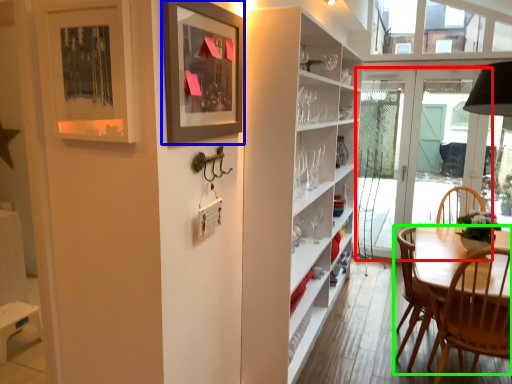
Question: Which object is positioned closest to door (highlighted by a red box)? Select from picture frame (highlighted by a blue box) and chair (highlighted by a green box).

Choices:
 (A) picture frame
 (B) chair

Answer: (B)